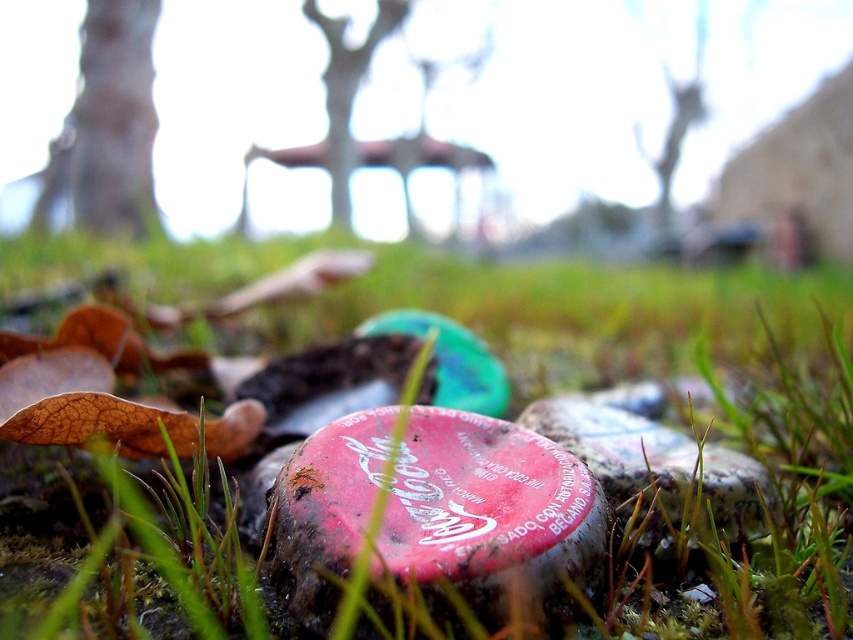
Question: Among these points, which one is nearest to the camera?

Choices:
 (A) (653, 38)
 (B) (73, 106)
 (C) (357, 468)

Answer: (C)

Question: Is green grass at center wider than smooth bark tree trunk at upper left?

Choices:
 (A) no
 (B) yes

Answer: (B)

Question: Which object appears farthest from the camera in this image?

Choices:
 (A) green matte tree at upper center
 (B) green grass at center

Answer: (A)

Question: Does smooth bark tree trunk at upper left appear on the left side of green matte tree at upper center?

Choices:
 (A) no
 (B) yes

Answer: (B)

Question: Which of the following is the closest to the observer?

Choices:
 (A) smooth bark tree trunk at upper left
 (B) green grass at center
 (C) speckled stone at center
 (D) rubberized red cap at center

Answer: (B)

Question: Does rubberized red cap at center come behind speckled stone at center?

Choices:
 (A) yes
 (B) no

Answer: (B)